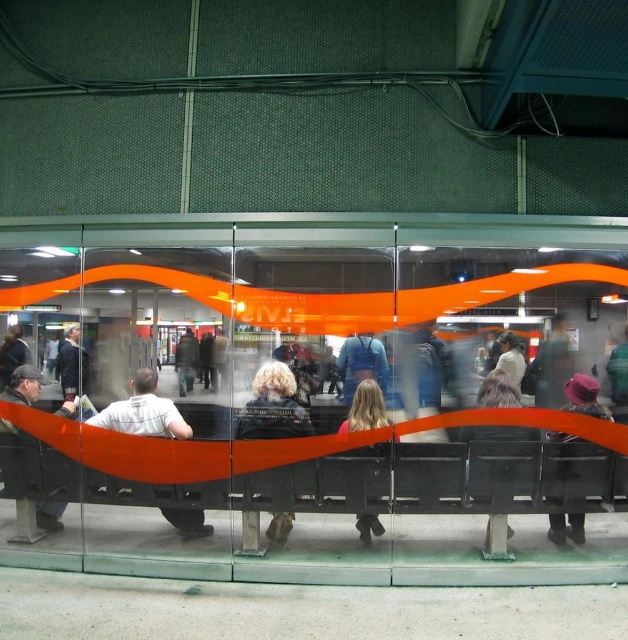
From the picture: Which is more to the left, velvet purple hat at center or matte black jacket at left?

matte black jacket at left

Does velvet purple hat at center have a greater width compared to matte black jacket at left?

In fact, velvet purple hat at center might be narrower than matte black jacket at left.

Describe the element at coordinates (583, 396) in the screenshot. I see `velvet purple hat at center` at that location.

Locate an element on the screen. Image resolution: width=628 pixels, height=640 pixels. velvet purple hat at center is located at coordinates (583, 396).

Is point (477, 440) farther from camera compared to point (73, 364)?

No, (477, 440) is closer to viewer.

Locate an element on the screen. This screenshot has width=628, height=640. dark brown leather jacket at lower right is located at coordinates (497, 390).

Does blonde hair at center have a greater width compared to dark brown leather jacket at center?

Indeed, blonde hair at center has a greater width compared to dark brown leather jacket at center.

Does blonde hair at center come in front of dark brown leather jacket at center?

No.

Which is in front, point (244, 410) or point (374, 522)?

Point (374, 522) is more forward.

Find the location of a particular element. This screenshot has width=628, height=640. blonde hair at center is located at coordinates (273, 406).